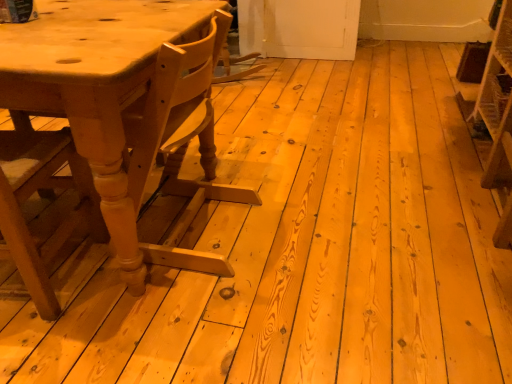
The image size is (512, 384). Find the location of `vacant space to the left of wooden crate at right`. vacant space to the left of wooden crate at right is located at coordinates (411, 158).